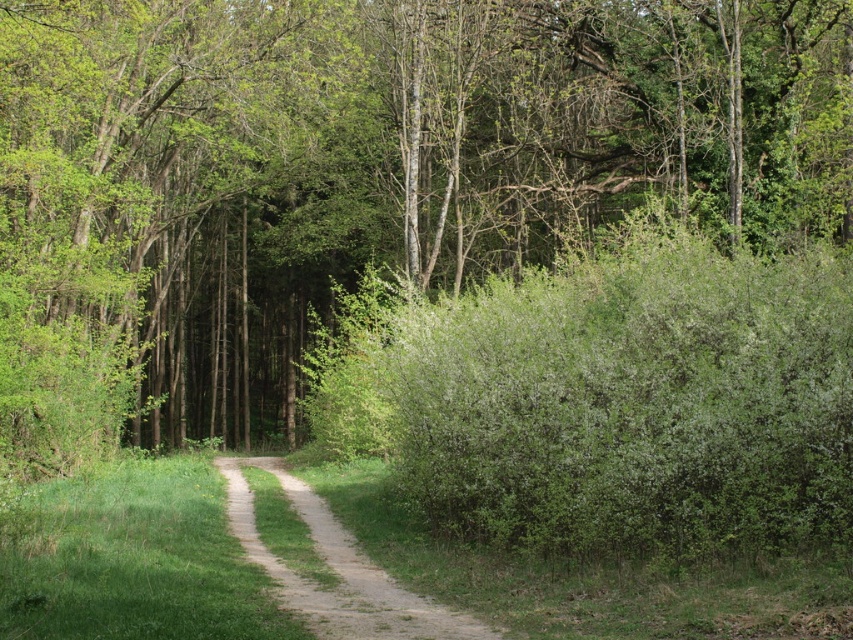
You are a hiker walking along the dirt path at center in the forest. You notice the green leafy bush at right nearby. Which one is closer to you as you walk on the path?

The green leafy bush at right is closer to you than the dirt path at center since it is further to the viewer, meaning it is nearer in your line of sight while walking on the path.

Based on the photo, you are a hiker carrying a backpack and want to walk along the dirt path at center. However, you notice the green leafy bush at right. Will the bush block your path? Please explain based on their heights.

The green leafy bush at right has a greater height compared to the dirt path at center. Since the bush is taller than the path, it may block your path depending on how close it grows to the path. However, the scene description mentions the path is bordered by lush green grass on both sides, implying the bushes might not fully obstruct the path. Further details about the bush width or proximity to the path would be needed for a precise assessment.

You are a hiker walking along the dirt path at center in the forest. You want to pick some white blossoms from the green leafy bush at right. Which direction should you walk to reach the bush?

The green leafy bush at right is to the right of the dirt path at center, so you should walk to the right to reach the bush.